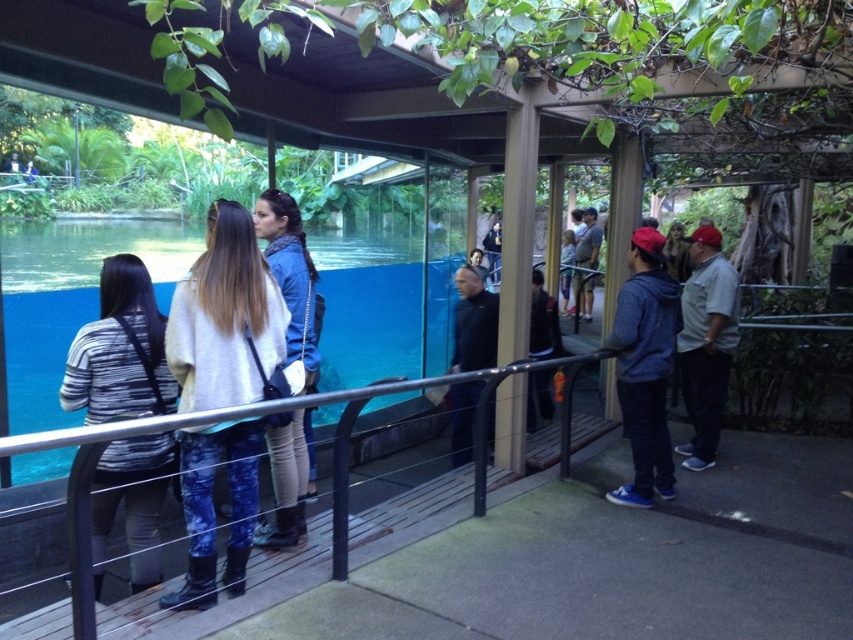
Based on the photo, between light gray cotton shirt at right and dark blue jacket at center, which one appears on the right side from the viewer's perspective?

light gray cotton shirt at right

Between light gray cotton shirt at right and dark blue jacket at center, which one is positioned higher?

light gray cotton shirt at right is higher up.

Is point (733, 337) positioned before point (546, 320)?

Yes, it is.

Locate an element on the screen. The width and height of the screenshot is (853, 640). light gray cotton shirt at right is located at coordinates (706, 342).

Which is more to the left, denim jacket at right or blue denim jacket at center?

blue denim jacket at center is more to the left.

Is point (621, 406) behind point (277, 500)?

Yes, point (621, 406) is behind point (277, 500).

At what (x,y) coordinates should I click in order to perform the action: click on denim jacket at right. Please return your answer as a coordinate pair (x, y). Looking at the image, I should click on (645, 365).

Which is more to the right, light beige sweater at center or dark blue jacket at center?

From the viewer's perspective, dark blue jacket at center appears more on the right side.

Who is more forward, (x=239, y=506) or (x=529, y=413)?

Point (x=239, y=506) is more forward.

Who is more forward, (193, 266) or (556, 346)?

Point (193, 266) is more forward.

Locate an element on the screen. light beige sweater at center is located at coordinates (225, 317).